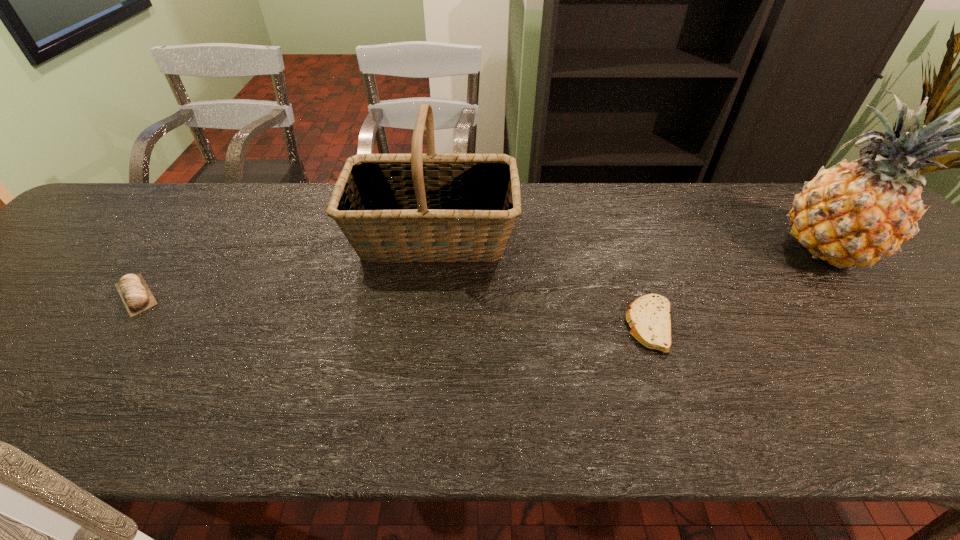
The image size is (960, 540). I want to click on the third closest object to the shortest object, so click(x=133, y=290).

Locate an element on the screen. The image size is (960, 540). vacant space that satisfies the following two spatial constraints: 1. by the handle of the basket; 2. on the left side of the rightmost object is located at coordinates (431, 251).

I want to click on free space that satisfies the following two spatial constraints: 1. by the handle of the basket; 2. on the left side of the right pita bread, so click(x=422, y=326).

Identify the location of vacant space that satisfies the following two spatial constraints: 1. by the handle of the basket; 2. on the back side of the pineapple. The image size is (960, 540). (431, 251).

In order to click on vacant space that satisfies the following two spatial constraints: 1. on the back side of the rightmost object; 2. by the handle of the second object from left to right in this screenshot , I will do `click(817, 236)`.

Where is `free space that satisfies the following two spatial constraints: 1. by the handle of the second tallest object; 2. on the left side of the pineapple`? The width and height of the screenshot is (960, 540). free space that satisfies the following two spatial constraints: 1. by the handle of the second tallest object; 2. on the left side of the pineapple is located at coordinates (431, 251).

Find the location of a particular element. This screenshot has height=540, width=960. vacant region that satisfies the following two spatial constraints: 1. by the handle of the tallest object; 2. on the right side of the basket is located at coordinates (431, 251).